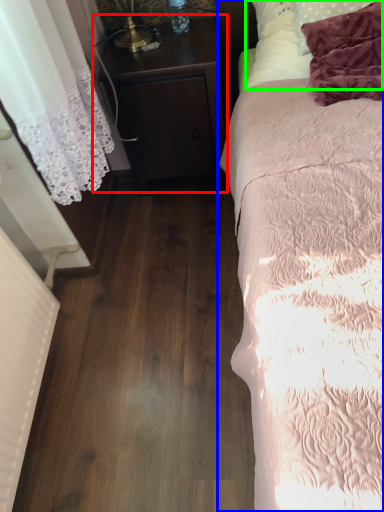
Question: Which object is positioned closest to nightstand (highlighted by a red box)? Select from bed (highlighted by a blue box) and pillow (highlighted by a green box).

Choices:
 (A) bed
 (B) pillow

Answer: (B)